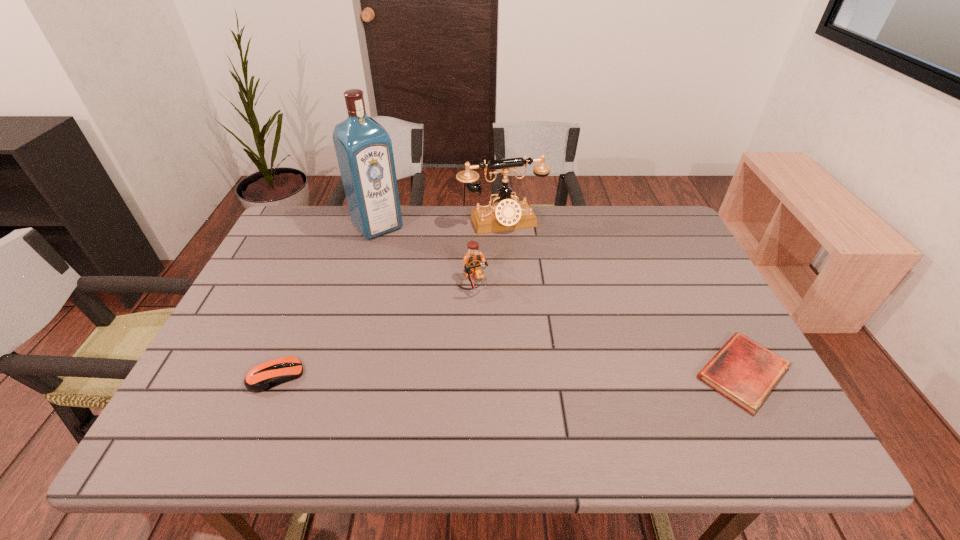
Where is `vacant area situated 0.370m on the flat label side of the liquor`? Image resolution: width=960 pixels, height=540 pixels. vacant area situated 0.370m on the flat label side of the liquor is located at coordinates [x=451, y=311].

Image resolution: width=960 pixels, height=540 pixels. I want to click on free space located 0.240m on the flat label side of the liquor, so click(x=427, y=282).

At what (x,y) coordinates should I click in order to perform the action: click on vacant area situated 0.070m holding a crossbow in the hands of the third farthest object. Please return your answer as a coordinate pair (x, y). The width and height of the screenshot is (960, 540). Looking at the image, I should click on (490, 315).

The image size is (960, 540). I want to click on free spot located 0.080m holding a crossbow in the hands of the third farthest object, so click(492, 318).

Identify the location of free space located holding a crossbow in the hands of the third farthest object. (498, 329).

Locate an element on the screen. The image size is (960, 540). free space located 0.060m on the dial of the telephone is located at coordinates (517, 246).

Where is `vacant space located on the dial of the telephone`? vacant space located on the dial of the telephone is located at coordinates (519, 251).

You are a GUI agent. You are given a task and a screenshot of the screen. Output one action in this format:
    pyautogui.click(x=<x>, y=<y>)
    Task: Click on the vacant space located 0.360m on the dial of the telephone
    The width and height of the screenshot is (960, 540).
    Given the screenshot: What is the action you would take?
    pyautogui.click(x=551, y=318)

This screenshot has height=540, width=960. I want to click on liquor at the far edge, so click(x=363, y=147).

The width and height of the screenshot is (960, 540). I want to click on telephone present at the far edge, so tap(506, 214).